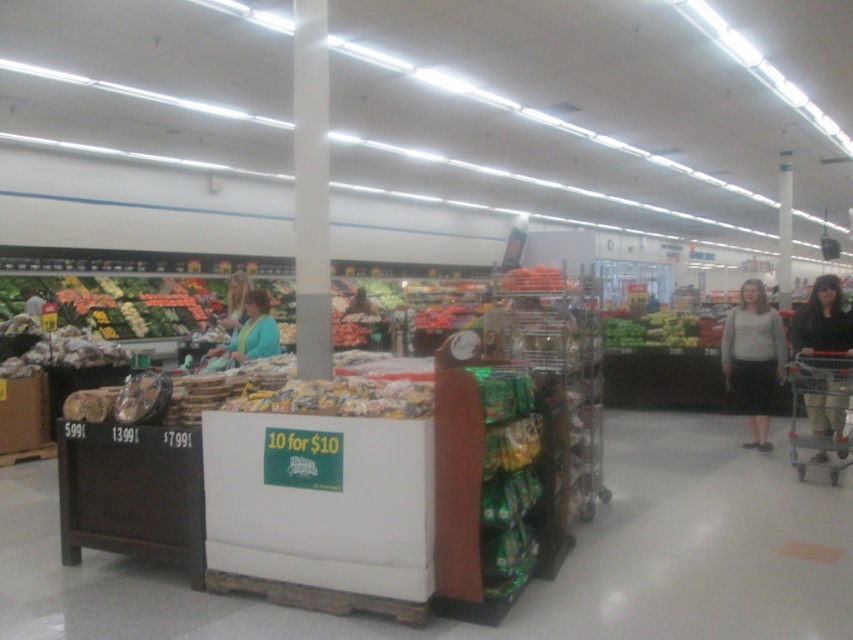
Is light gray sweater at right positioned before teal fabric jacket at center?

No.

Is point (741, 397) farther from viewer compared to point (276, 324)?

Yes.

Does point (761, 289) come behind point (256, 321)?

Yes, it is behind point (256, 321).

Find the location of a particular element. The height and width of the screenshot is (640, 853). light gray sweater at right is located at coordinates (753, 358).

Which is below, metallic silver shopping cart at lower right or teal fabric jacket at center?

metallic silver shopping cart at lower right

Image resolution: width=853 pixels, height=640 pixels. Find the location of `metallic silver shopping cart at lower right`. metallic silver shopping cart at lower right is located at coordinates (820, 410).

Image resolution: width=853 pixels, height=640 pixels. Identify the location of metallic silver shopping cart at lower right. (820, 410).

Is point (741, 372) farther from camera compared to point (804, 445)?

Yes, point (741, 372) is behind point (804, 445).

Image resolution: width=853 pixels, height=640 pixels. In order to click on light gray sweater at right in this screenshot , I will do `click(753, 358)`.